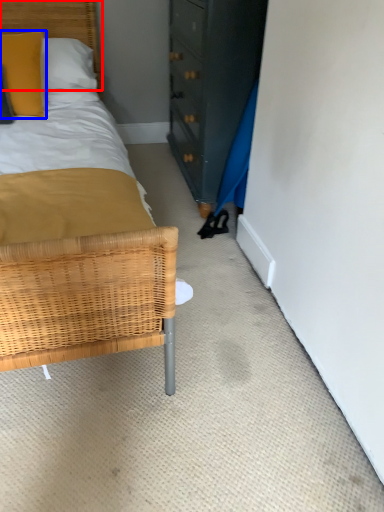
Question: Which object is closer to the camera taking this photo, headboard (highlighted by a red box) or pillow (highlighted by a blue box)?

Choices:
 (A) headboard
 (B) pillow

Answer: (B)